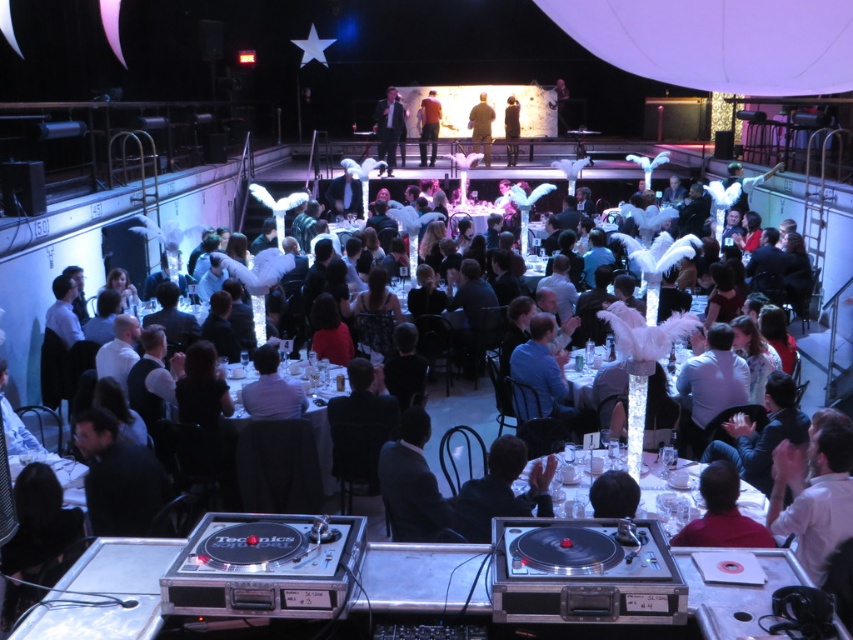
Does black matte hair at center appear under orange cotton shirt at center?

Yes.

Is black matte hair at center smaller than orange cotton shirt at center?

Yes, black matte hair at center is smaller than orange cotton shirt at center.

Between point (618, 504) and point (430, 93), which one is positioned in front?

Point (618, 504) is in front.

Identify the location of black matte hair at center. (614, 493).

Is point (674, 390) farther from camera compared to point (518, 134)?

No, it is in front of (518, 134).

Is white feathered centerpiece at center positioned behind dark gray suit at center?

No.

Is point (689, 353) less distant than point (503, 116)?

Yes, point (689, 353) is in front of point (503, 116).

You are a GUI agent. You are given a task and a screenshot of the screen. Output one action in this format:
    pyautogui.click(x=<x>, y=<y>)
    Task: Click on the white feathered centerpiece at center
    
    Given the screenshot: What is the action you would take?
    pyautogui.click(x=583, y=372)

Image resolution: width=853 pixels, height=640 pixels. What do you see at coordinates (387, 128) in the screenshot?
I see `matte black suit at upper center` at bounding box center [387, 128].

Does matte black suit at upper center appear on the right side of orange cotton shirt at center?

Incorrect, matte black suit at upper center is not on the right side of orange cotton shirt at center.

What do you see at coordinates (387, 128) in the screenshot? This screenshot has width=853, height=640. I see `matte black suit at upper center` at bounding box center [387, 128].

The image size is (853, 640). In order to click on matte black suit at upper center in this screenshot , I will do `click(387, 128)`.